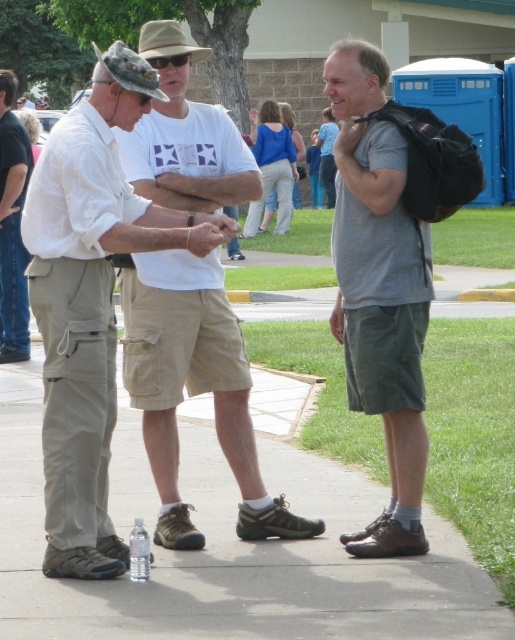
Question: Which point is farther from the camera taking this photo?

Choices:
 (A) (384, 148)
 (B) (42, 461)
 (C) (30, 168)
 (D) (198, 371)

Answer: (C)

Question: Does matte khaki pants at center have a larger size compared to clear plastic bottle at center?

Choices:
 (A) no
 (B) yes

Answer: (B)

Question: Is gray matte t-shirt at right closer to the viewer compared to clear plastic bottle at center?

Choices:
 (A) yes
 (B) no

Answer: (B)

Question: Is matte khaki pants at center closer to the viewer compared to clear plastic bottle at center?

Choices:
 (A) no
 (B) yes

Answer: (A)

Question: Considering the real-world distances, which object is farthest from the khaki cotton shorts at center?

Choices:
 (A) khaki cargo pants at center
 (B) gray matte t-shirt at right
 (C) matte khaki pants at center
 (D) clear plastic bottle at center

Answer: (C)

Question: Estimate the real-world distances between objects in this image. Which object is farther from the gray matte t-shirt at right?

Choices:
 (A) khaki cotton shorts at center
 (B) khaki cargo pants at center
 (C) matte khaki pants at center

Answer: (C)